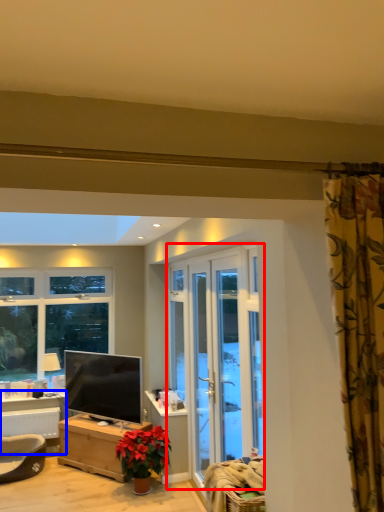
Question: Which of the following is the farthest to the observer, screen door (highlighted by a red box) or table (highlighted by a blue box)?

Choices:
 (A) screen door
 (B) table

Answer: (B)